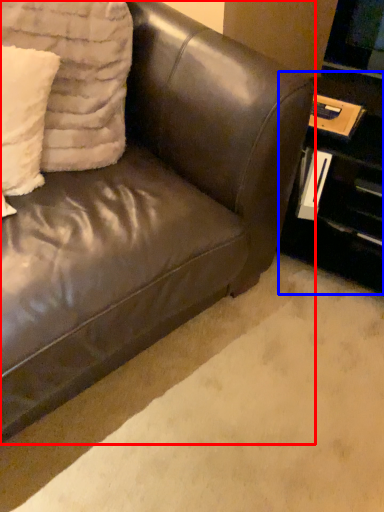
Question: Among these objects, which one is nearest to the camera, studio couch (highlighted by a red box) or table (highlighted by a blue box)?

Choices:
 (A) studio couch
 (B) table

Answer: (A)